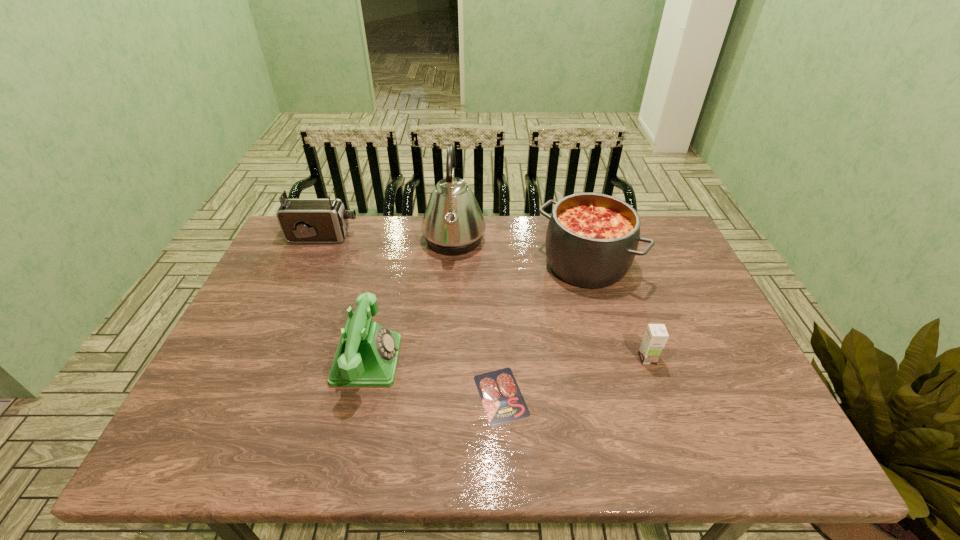
You are a GUI agent. You are given a task and a screenshot of the screen. Output one action in this format:
    pyautogui.click(x=<x>, y=<y>)
    Task: Click on the vacant space at the left edge
    The image size is (960, 540).
    Given the screenshot: What is the action you would take?
    pyautogui.click(x=254, y=322)

In the image, there is a desktop. Identify the location of vacant space at the right edge. (693, 332).

The width and height of the screenshot is (960, 540). In the image, there is a desktop. In order to click on vacant space at the far left corner in this screenshot , I will do `click(276, 249)`.

Identify the location of free space at the near left corner of the desktop. The width and height of the screenshot is (960, 540). (186, 461).

The width and height of the screenshot is (960, 540). Identify the location of vacant space at the far right corner of the desktop. (660, 238).

In the image, there is a desktop. Identify the location of free region at the near right corner. (738, 463).

At what (x,y) coordinates should I click in order to perform the action: click on free area in between the second shortest object and the casserole. Please return your answer as a coordinate pair (x, y). The height and width of the screenshot is (540, 960). Looking at the image, I should click on (616, 312).

Locate an element on the screen. vacant area that lies between the shortest object and the fifth tallest object is located at coordinates (574, 377).

This screenshot has width=960, height=540. In order to click on vacant region between the salami and the fifth tallest object in this screenshot , I will do `click(574, 377)`.

You are a GUI agent. You are given a task and a screenshot of the screen. Output one action in this format:
    pyautogui.click(x=<x>, y=<y>)
    Task: Click on the empty space that is in between the leftmost object and the tallest object
    
    Given the screenshot: What is the action you would take?
    pyautogui.click(x=389, y=239)